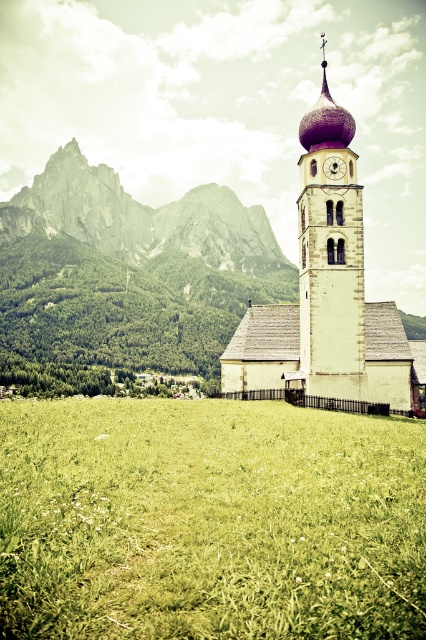
Question: Is the position of smooth stone clock tower at center more distant than that of wooden clock at center?

Choices:
 (A) yes
 (B) no

Answer: (B)

Question: Which object is positioned farthest from the white stone church at center?

Choices:
 (A) gray rock formation at upper left
 (B) smooth stone clock tower at center
 (C) wooden clock at center
 (D) green grass at center

Answer: (A)

Question: Considering the real-world distances, which object is closest to the wooden clock at center?

Choices:
 (A) gray rock formation at upper left
 (B) smooth stone clock tower at center
 (C) white stone church at center
 (D) green grass at center

Answer: (B)

Question: Does gray rock formation at upper left have a lesser width compared to smooth stone clock tower at center?

Choices:
 (A) no
 (B) yes

Answer: (A)

Question: Can you confirm if gray rock formation at upper left is bigger than smooth stone clock tower at center?

Choices:
 (A) yes
 (B) no

Answer: (A)

Question: Which point is closer to the camera?

Choices:
 (A) wooden clock at center
 (B) green grass at center
 (C) gray rock formation at upper left

Answer: (B)